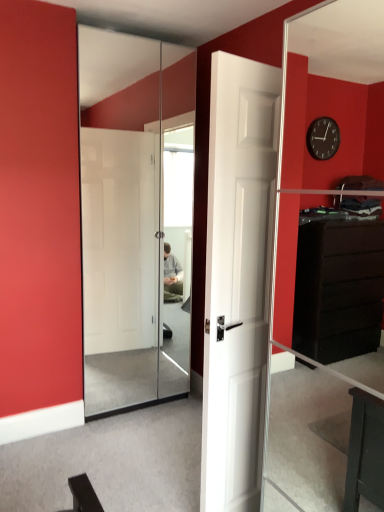
Image resolution: width=384 pixels, height=512 pixels. What do you see at coordinates (135, 218) in the screenshot? I see `white glossy sliding doors at center` at bounding box center [135, 218].

The width and height of the screenshot is (384, 512). I want to click on white glossy sliding doors at center, so click(135, 218).

You are a GUI agent. You are given a task and a screenshot of the screen. Output one action in this format:
    pyautogui.click(x=<x>, y=<y>)
    Task: Click on the white matte door at center
    
    Given the screenshot: What is the action you would take?
    pyautogui.click(x=237, y=278)

Describe the element at coordinates (237, 278) in the screenshot. I see `white matte door at center` at that location.

Identify the location of white glossy sliding doors at center. This screenshot has height=512, width=384. (135, 218).

In the scene shown: Does white glossy sliding doors at center appear on the left side of white matte door at center?

Yes.

Is white glossy sliding doors at center in front of or behind white matte door at center in the image?

In the image, white glossy sliding doors at center appears behind white matte door at center.

Is point (180, 362) closer or farther from the camera than point (251, 133)?

Point (180, 362) is farther from the camera than point (251, 133).

From the image's perspective, does white glossy sliding doors at center appear lower than white matte door at center?

No, from the image's perspective, white glossy sliding doors at center is not below white matte door at center.

From a real-world perspective, does white glossy sliding doors at center stand above white matte door at center?

Correct, in the physical world, white glossy sliding doors at center is higher than white matte door at center.

Considering the relative sizes of white glossy sliding doors at center and white matte door at center in the image provided, is white glossy sliding doors at center thinner than white matte door at center?

Indeed, white glossy sliding doors at center has a lesser width compared to white matte door at center.

Between white glossy sliding doors at center and white matte door at center, which one has less height?

white matte door at center is shorter.

Does white glossy sliding doors at center have a smaller size compared to white matte door at center?

Correct, white glossy sliding doors at center occupies less space than white matte door at center.

Which is correct: white glossy sliding doors at center is inside white matte door at center, or outside of it?

white glossy sliding doors at center cannot be found inside white matte door at center.

Are white glossy sliding doors at center and white matte door at center far apart?

Yes, white glossy sliding doors at center and white matte door at center are quite far apart.

Is white glossy sliding doors at center facing towards white matte door at center?

Yes, white glossy sliding doors at center is turned towards white matte door at center.

Can you tell me how much white glossy sliding doors at center and white matte door at center differ in facing direction?

The facing directions of white glossy sliding doors at center and white matte door at center are 171 degrees apart.

Locate an element on the screen. The width and height of the screenshot is (384, 512). screen door that appears behind the white matte door at center is located at coordinates (135, 218).

Considering the positions of objects white matte door at center and white glossy sliding doors at center in the image provided, who is more to the right, white matte door at center or white glossy sliding doors at center?

From the viewer's perspective, white matte door at center appears more on the right side.

Between white matte door at center and white glossy sliding doors at center, which one is positioned behind?

white glossy sliding doors at center is more distant.

Which is closer, (221, 261) or (83, 57)?

The point (221, 261) is more forward.

From the picture: From the image's perspective, between white matte door at center and white glossy sliding doors at center, who is located below?

white matte door at center.

From a real-world perspective, who is located higher, white matte door at center or white glossy sliding doors at center?

From a 3D spatial view, white glossy sliding doors at center is above.

Considering the relative sizes of white matte door at center and white glossy sliding doors at center in the image provided, is white matte door at center thinner than white glossy sliding doors at center?

No.

Does white matte door at center have a lesser height compared to white glossy sliding doors at center?

Indeed, white matte door at center has a lesser height compared to white glossy sliding doors at center.

Which of these two, white matte door at center or white glossy sliding doors at center, is smaller?

With smaller size is white glossy sliding doors at center.

Would you say white matte door at center is inside or outside white glossy sliding doors at center?

white matte door at center is outside white glossy sliding doors at center.

Are white matte door at center and white glossy sliding doors at center far apart?

Yes, white matte door at center and white glossy sliding doors at center are located far from each other.

Is white matte door at center positioned with its back to white glossy sliding doors at center?

Yes, white glossy sliding doors at center is at the back of white matte door at center.

Can you tell me how much white matte door at center and white glossy sliding doors at center differ in facing direction?

There is a 171-degree angle between the facing directions of white matte door at center and white glossy sliding doors at center.

Find the location of a particular element. The image size is (384, 512). door that is under the white glossy sliding doors at center (from a real-world perspective) is located at coordinates (237, 278).

You are a GUI agent. You are given a task and a screenshot of the screen. Output one action in this format:
    pyautogui.click(x=<x>, y=<y>)
    Task: Click on the door that is in front of the white glossy sliding doors at center
    
    Given the screenshot: What is the action you would take?
    pyautogui.click(x=237, y=278)

You are a GUI agent. You are given a task and a screenshot of the screen. Output one action in this format:
    pyautogui.click(x=<x>, y=<y>)
    Task: Click on the door below the white glossy sliding doors at center (from a real-world perspective)
    
    Given the screenshot: What is the action you would take?
    (x=237, y=278)